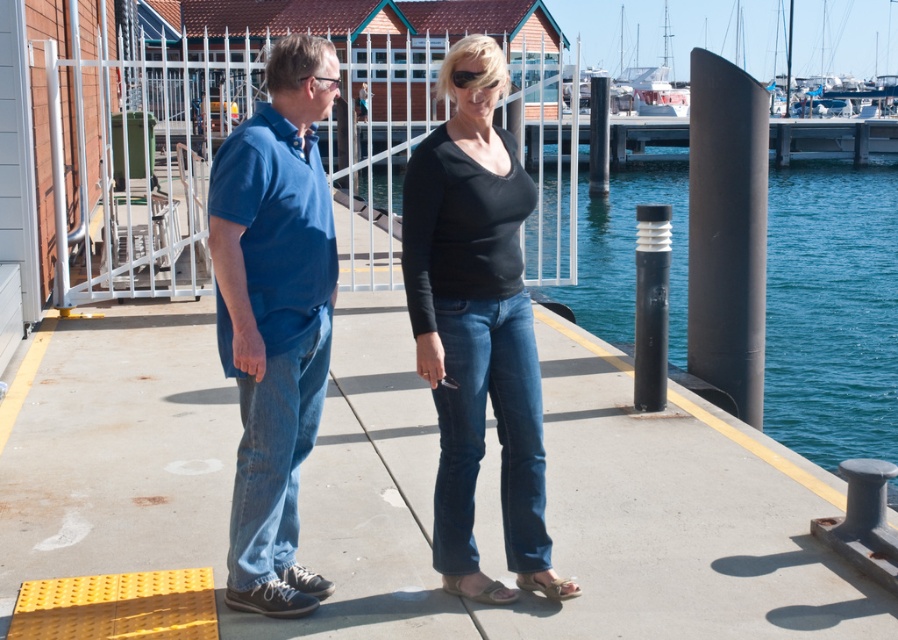
In the scene shown: You are a photographer trying to capture a photo of the two people on the dock. The blue denim jeans at center are part of their clothing. How far apart should you position them to ensure both are in frame?

The blue denim jeans at center are 11.13 feet apart, so you should position the camera to include both subjects within the frame at that distance.

You are standing on the dock and want to pick up the brown leather sandal at lower center. Which direction should you move relative to the blue water at center?

The brown leather sandal at lower center is behind the blue water at center, so you should move towards the back of the dock away from the blue water at center to reach it.